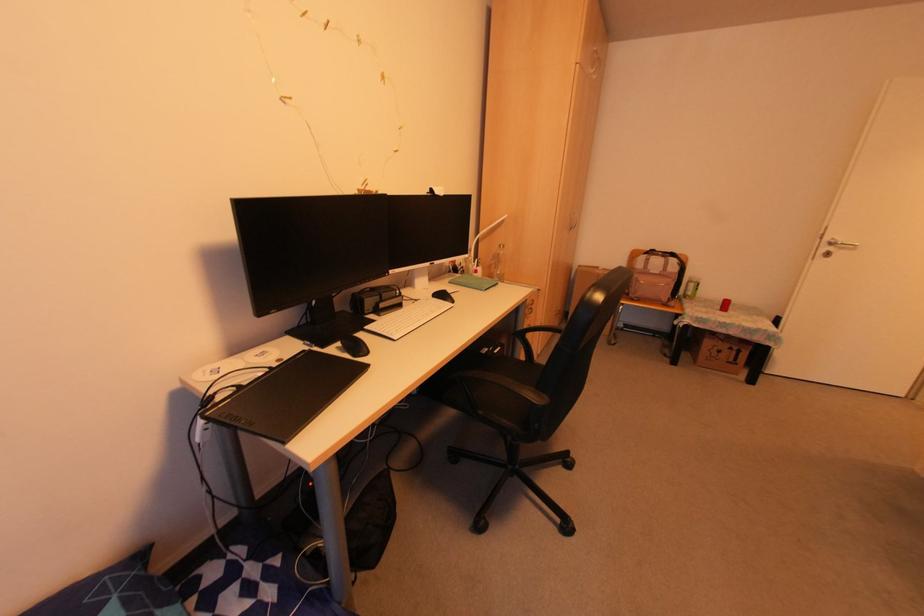
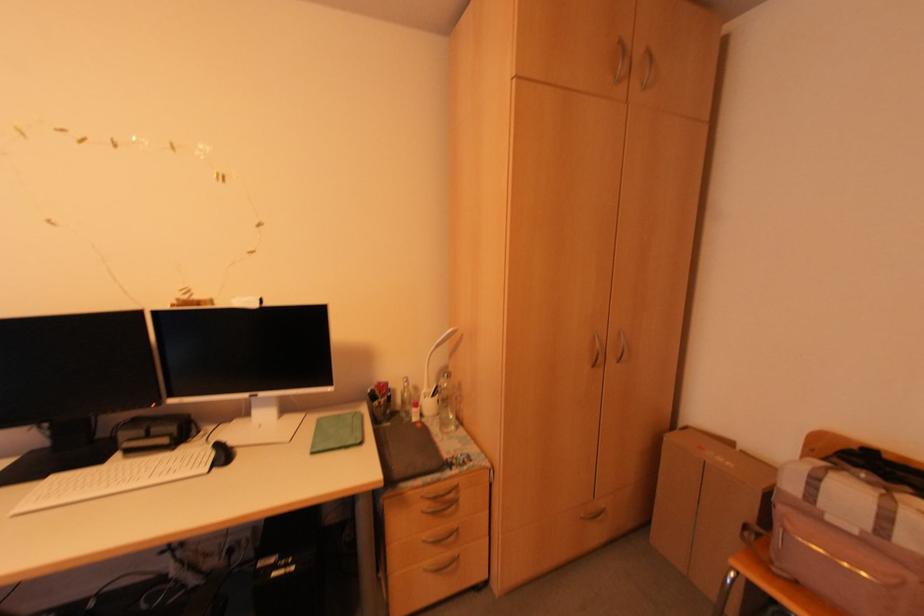
Find the pixel in the second image that matches [596,268] in the first image.

(728, 444)